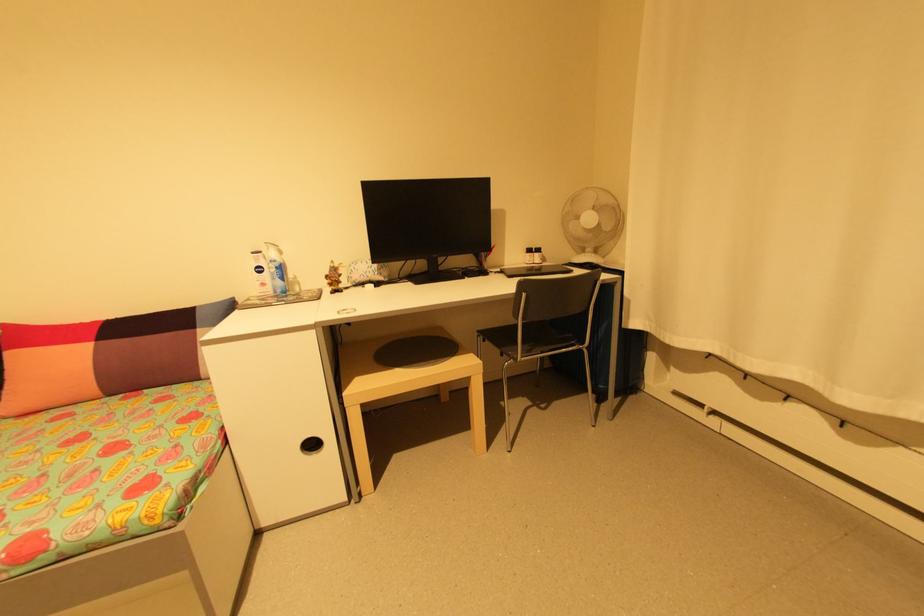
The height and width of the screenshot is (616, 924). Identify the location of cabinet cutout handle. (310, 445).